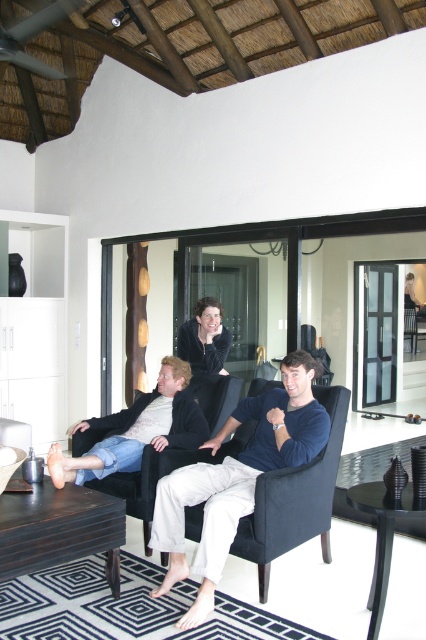
Question: Which point is farther from the camera taking this photo?

Choices:
 (A) (317, 436)
 (B) (178, 348)
 (C) (189, 417)

Answer: (B)

Question: Can you confirm if dark blue fabric armchair at center is smaller than matte black jacket at center?

Choices:
 (A) no
 (B) yes

Answer: (A)

Question: Is light beige cotton pants at center further to the viewer compared to matte black jacket at center?

Choices:
 (A) no
 (B) yes

Answer: (A)

Question: Which object appears farthest from the camera in this image?

Choices:
 (A) matte black jacket at center
 (B) dark blue fabric armchair at center

Answer: (A)

Question: Considering the relative positions of dark blue fabric armchair at center and matte black jacket at center in the image provided, where is dark blue fabric armchair at center located with respect to matte black jacket at center?

Choices:
 (A) left
 (B) right

Answer: (A)

Question: Among these points, which one is nearest to the camera?

Choices:
 (A) [x=204, y=381]
 (B) [x=224, y=360]

Answer: (A)